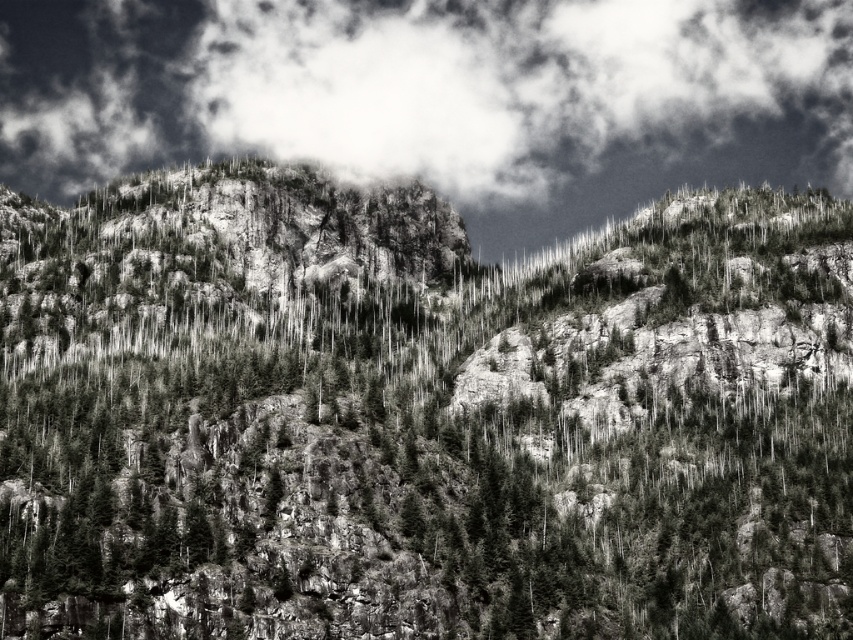
Can you confirm if dark gray textured rock at center is taller than white fluffy cloud at upper center?

Incorrect, dark gray textured rock at center's height is not larger of white fluffy cloud at upper center's.

Is dark gray textured rock at center behind white fluffy cloud at upper center?

No, dark gray textured rock at center is in front of white fluffy cloud at upper center.

You are a GUI agent. You are given a task and a screenshot of the screen. Output one action in this format:
    pyautogui.click(x=<x>, y=<y>)
    Task: Click on the dark gray textured rock at center
    The image size is (853, 640).
    Given the screenshot: What is the action you would take?
    pyautogui.click(x=421, y=417)